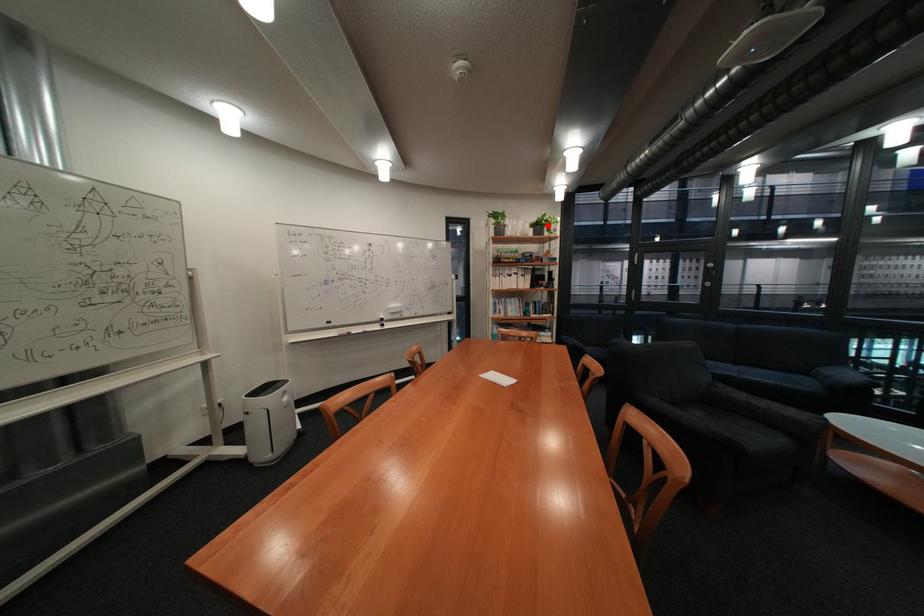
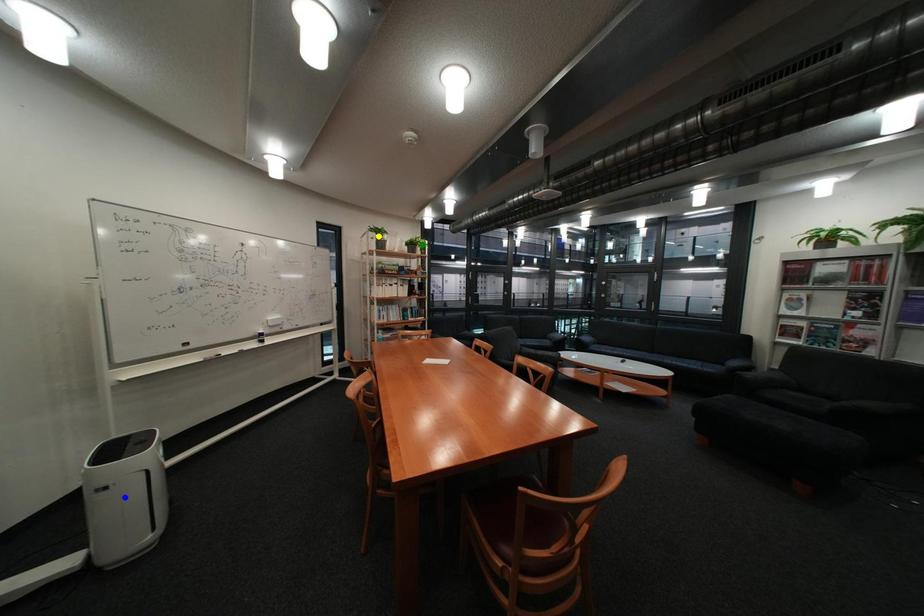
Question: I am providing you with two images of the same scene from different viewpoints. A red point is marked on the first image. You are given multiple points on the second image. Which point in image 2 is actually the same real-world point as the red point in image 1?

Choices:
 (A) yellow point
 (B) blue point
 (C) green point

Answer: (C)